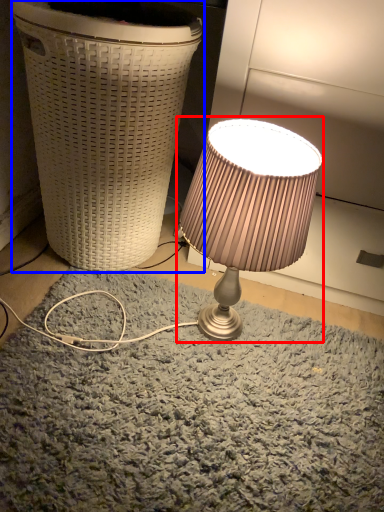
Question: Which object appears closest to the camera in this image, lamp (highlighted by a red box) or waste container (highlighted by a blue box)?

Choices:
 (A) lamp
 (B) waste container

Answer: (A)